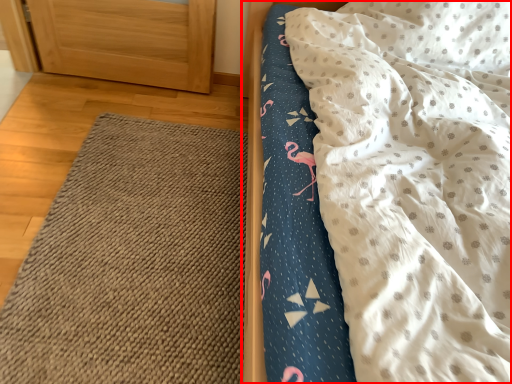
Question: Considering the relative positions of bed (annotated by the red box) and mat in the image provided, where is bed (annotated by the red box) located with respect to the staircase?

Choices:
 (A) left
 (B) right

Answer: (B)